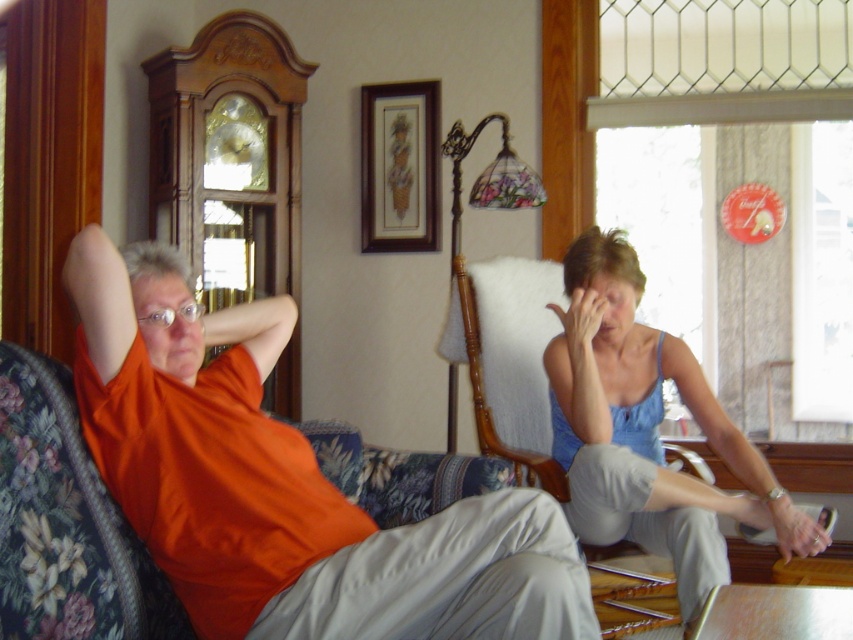
You are arranging a photo shoot in this living room and need to position a spotlight. The spotlight can only illuminate objects to the right of the light blue fabric armchair at center. Will the orange cotton shirt at left be lit by the spotlight?

The orange cotton shirt at left is to the left of the light blue fabric armchair at center, so it will not be lit by the spotlight since it is positioned to the left of the armchair.

You are standing in the living room and want to sit down. The light blue fabric armchair at center is represented by point [508,356]. Which direction should you walk to reach it?

The light blue fabric armchair at center is located at point 0.596, so you should walk towards the center of the room to reach it.

You are planning to place a new rectangular coffee table between the light blue fabric armchair at center and the wooden picture frame at upper center. The coffee table must be narrower than both objects. Can you fit it between them?

The light blue fabric armchair at center is wider than the wooden picture frame at upper center. Since the coffee table needs to be narrower than both, it can be placed between them as long as its width is less than the narrower object, which is the wooden picture frame at upper center.